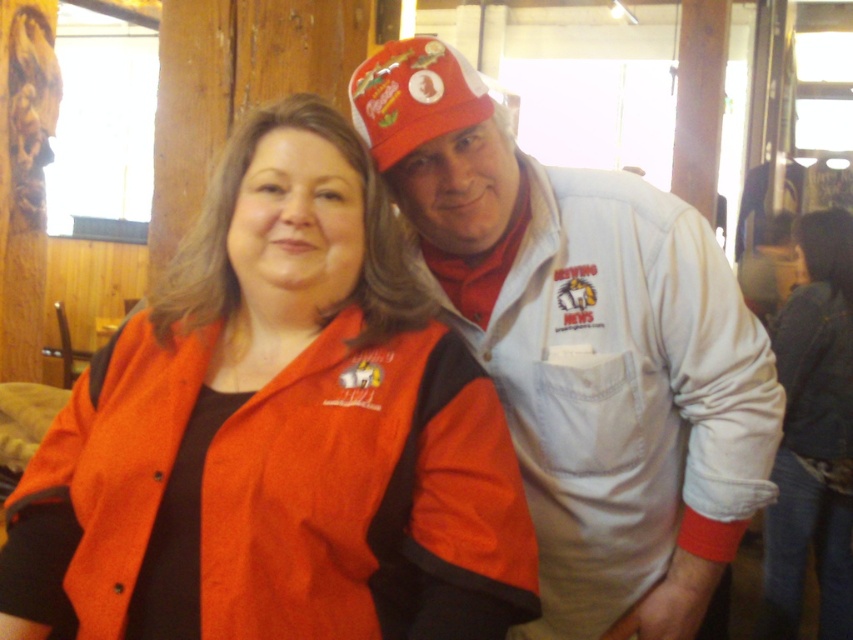
Which is below, orange fabric jacket at center or denim jacket at lower right?

denim jacket at lower right

Which is above, orange fabric jacket at center or denim jacket at lower right?

orange fabric jacket at center is higher up.

The width and height of the screenshot is (853, 640). Find the location of `orange fabric jacket at center`. orange fabric jacket at center is located at coordinates (277, 435).

Between white cotton shirt at upper right and matte red cap at upper center, which one has less height?

matte red cap at upper center is shorter.

How far apart are white cotton shirt at upper right and matte red cap at upper center?

25.34 centimeters

Is point (715, 579) behind point (384, 163)?

That is True.

The width and height of the screenshot is (853, 640). In order to click on white cotton shirt at upper right in this screenshot , I will do `click(585, 348)`.

In order to click on orange fabric jacket at center in this screenshot , I will do `click(277, 435)`.

Which of these two, orange fabric jacket at center or matte red cap at upper center, stands shorter?

matte red cap at upper center is shorter.

Identify the location of orange fabric jacket at center. (277, 435).

Locate an element on the screen. orange fabric jacket at center is located at coordinates (277, 435).